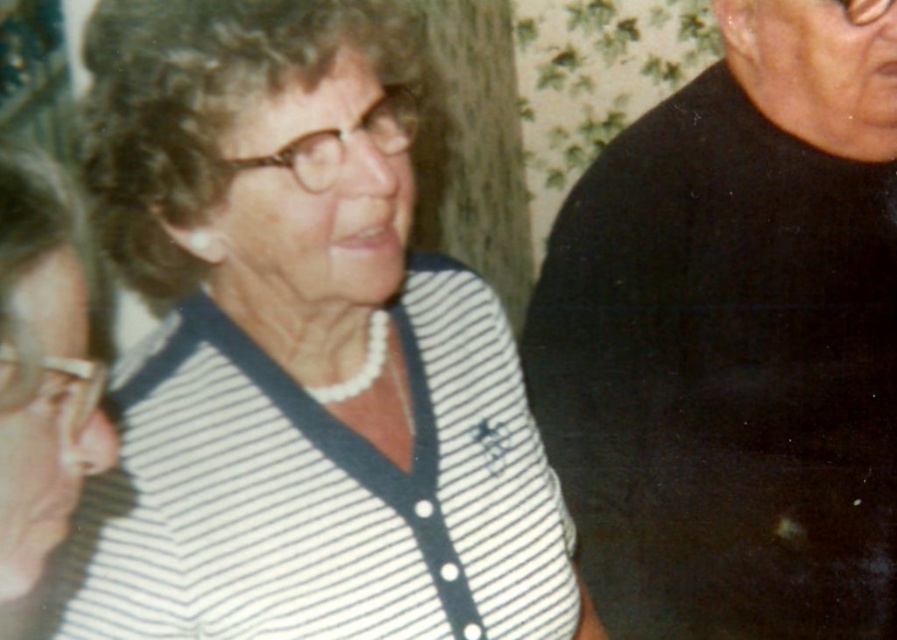
Between black matte shirt at right and matte black shirt at upper right, which one appears on the right side from the viewer's perspective?

Positioned to the right is black matte shirt at right.

Does black matte shirt at right appear on the right side of matte black shirt at upper right?

Yes, black matte shirt at right is to the right of matte black shirt at upper right.

Identify the location of black matte shirt at right. (736, 340).

You are a GUI agent. You are given a task and a screenshot of the screen. Output one action in this format:
    pyautogui.click(x=<x>, y=<y>)
    Task: Click on the black matte shirt at right
    
    Given the screenshot: What is the action you would take?
    pyautogui.click(x=736, y=340)

Who is more distant from viewer, (250,320) or (48,605)?

The point (250,320) is behind.

Does white striped sweater at center appear on the right side of matte black shirt at upper right?

Correct, you'll find white striped sweater at center to the right of matte black shirt at upper right.

Measure the distance between white striped sweater at center and camera.

26.79 inches

The image size is (897, 640). What are the coordinates of `white striped sweater at center` in the screenshot? It's located at (295, 294).

Can you confirm if black matte shirt at right is bigger than white striped sweater at center?

Incorrect, black matte shirt at right is not larger than white striped sweater at center.

Is black matte shirt at right smaller than white striped sweater at center?

Yes.

What do you see at coordinates (736, 340) in the screenshot?
I see `black matte shirt at right` at bounding box center [736, 340].

Where is `black matte shirt at right`? The width and height of the screenshot is (897, 640). black matte shirt at right is located at coordinates (736, 340).